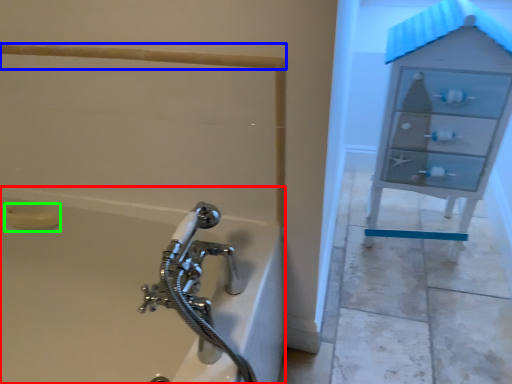
Question: Estimate the real-world distances between objects in this image. Which object is closer to bathtub (highlighted by a red box), rail (highlighted by a blue box) or soap (highlighted by a green box)?

Choices:
 (A) rail
 (B) soap

Answer: (B)